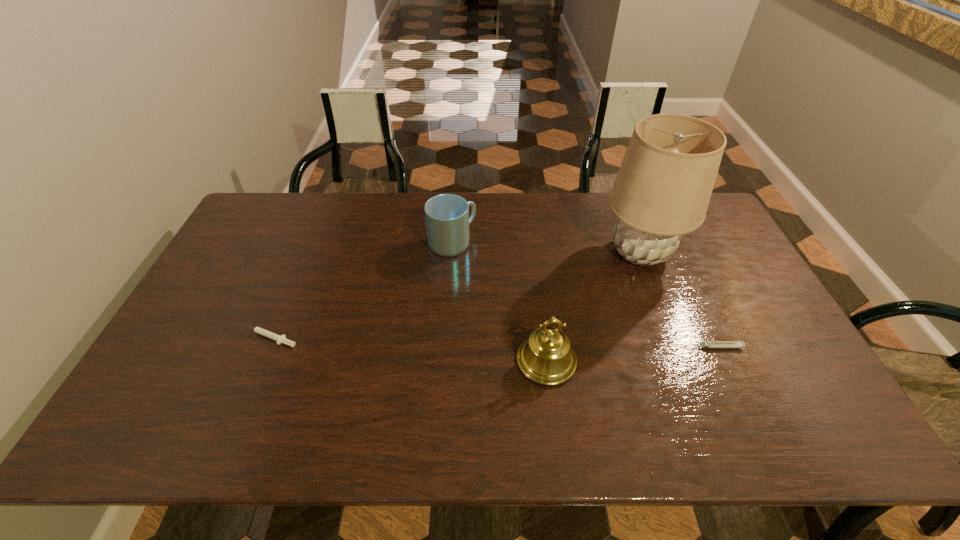
The width and height of the screenshot is (960, 540). Find the location of `free space between the leftmost object and the mug`. free space between the leftmost object and the mug is located at coordinates (361, 290).

Locate an element on the screen. Image resolution: width=960 pixels, height=540 pixels. vacant space that is in between the right syringe and the left syringe is located at coordinates (492, 342).

At what (x,y) coordinates should I click in order to perform the action: click on vacant area that lies between the lampshade and the bell. Please return your answer as a coordinate pair (x, y). Looking at the image, I should click on (593, 307).

Locate an element on the screen. free space between the right syringe and the lampshade is located at coordinates (678, 300).

I want to click on empty space that is in between the fourth object from right to left and the left syringe, so click(x=361, y=290).

Where is `free space between the lampshade and the left syringe`? free space between the lampshade and the left syringe is located at coordinates (455, 295).

Find the location of a particular element. vacant region between the right syringe and the mug is located at coordinates (584, 295).

The image size is (960, 540). Find the location of `vacant space that is in between the fourth object from right to left and the bell`. vacant space that is in between the fourth object from right to left and the bell is located at coordinates (499, 302).

Where is `free space between the fourth object from right to left and the right syringe`? The width and height of the screenshot is (960, 540). free space between the fourth object from right to left and the right syringe is located at coordinates (584, 295).

This screenshot has height=540, width=960. Find the location of `free space between the lampshade and the left syringe`. free space between the lampshade and the left syringe is located at coordinates (x=455, y=295).